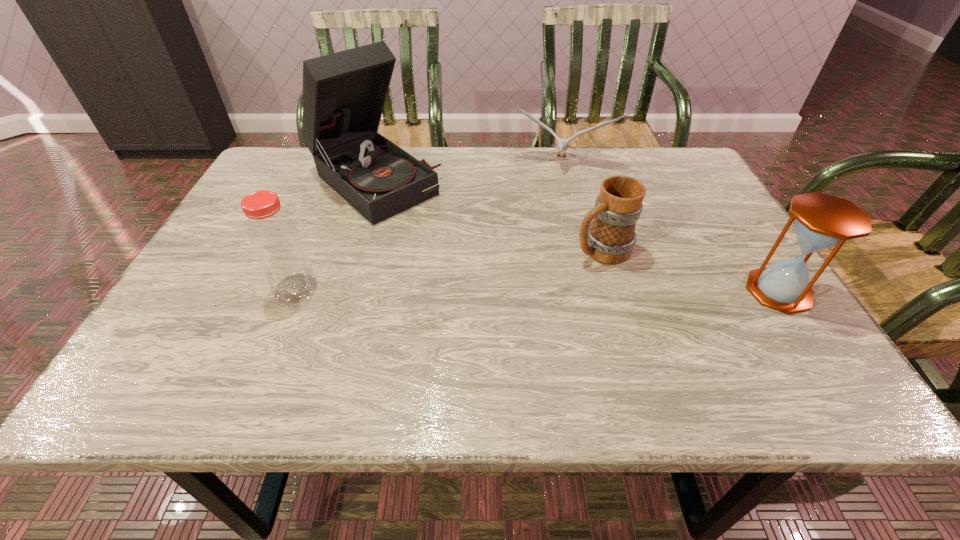
Locate an element on the screen. The height and width of the screenshot is (540, 960). bottle is located at coordinates (275, 240).

Locate an element on the screen. This screenshot has width=960, height=540. the rightmost object is located at coordinates (822, 221).

Locate an element on the screen. The image size is (960, 540). gull is located at coordinates (562, 144).

Image resolution: width=960 pixels, height=540 pixels. In order to click on the third nearest object in this screenshot , I will do `click(610, 238)`.

You are a GUI agent. You are given a task and a screenshot of the screen. Output one action in this format:
    pyautogui.click(x=<x>, y=<y>)
    Task: Click on the tallest object
    Image resolution: width=960 pixels, height=540 pixels.
    Given the screenshot: What is the action you would take?
    pyautogui.click(x=344, y=93)

Locate an element on the screen. Image resolution: width=960 pixels, height=540 pixels. vacant space located on the left of the bottle is located at coordinates (249, 288).

Identify the location of free space located on the back of the rightmost object. The height and width of the screenshot is (540, 960). (722, 204).

This screenshot has height=540, width=960. I want to click on vacant space located 0.060m at the tip of the beak of the gull, so click(544, 187).

Identify the location of vacant space located 0.250m at the tip of the beak of the gull. (533, 231).

This screenshot has height=540, width=960. What are the coordinates of `blank space located at the tip of the beak of the gull` in the screenshot? It's located at (544, 187).